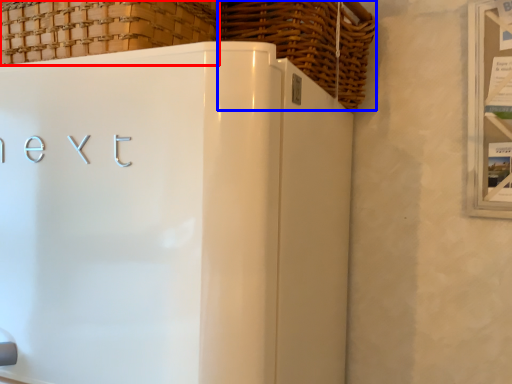
Question: Which object is further to the camera taking this photo, basket (highlighted by a red box) or basket (highlighted by a blue box)?

Choices:
 (A) basket
 (B) basket

Answer: (B)